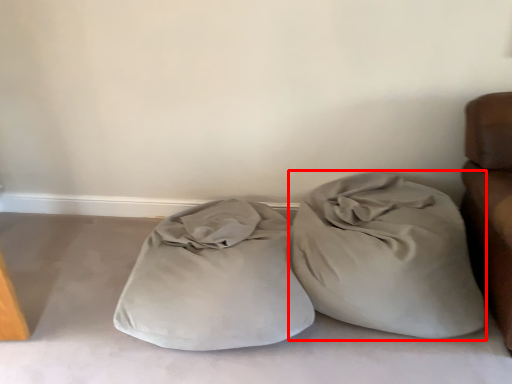
Question: From the image's perspective, where is throw pillow (annotated by the red box) located in relation to pillow in the image?

Choices:
 (A) above
 (B) below

Answer: (A)